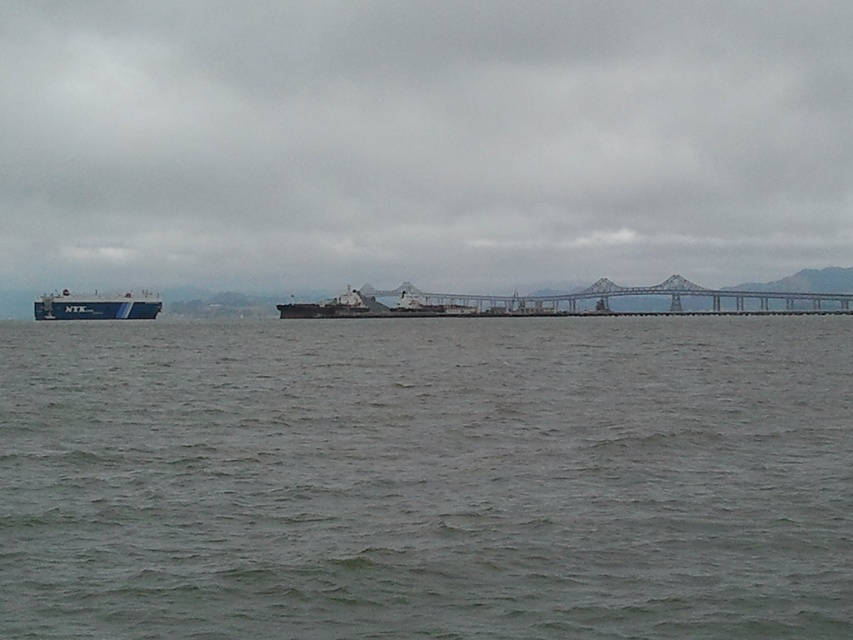
Question: Is gray matte water at center to the left of blue matte ship at left from the viewer's perspective?

Choices:
 (A) yes
 (B) no

Answer: (B)

Question: Considering the real-world distances, which object is farthest from the blue matte ship at left?

Choices:
 (A) gray matte water at center
 (B) blue matte cargo ship at left

Answer: (A)

Question: Which of the following is the farthest from the observer?

Choices:
 (A) (35, 314)
 (B) (375, 355)
 (C) (601, 296)

Answer: (C)

Question: Can you confirm if gray matte water at center is positioned above metallic gray bridge at center?

Choices:
 (A) yes
 (B) no

Answer: (B)

Question: Which object is farther from the camera taking this photo?

Choices:
 (A) blue matte ship at left
 (B) blue matte cargo ship at left

Answer: (A)

Question: Does metallic gray bridge at center come behind blue matte cargo ship at left?

Choices:
 (A) yes
 (B) no

Answer: (A)